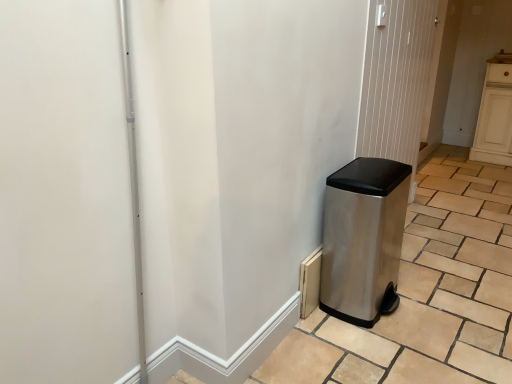
Question: From their relative heights in the image, would you say stainless steel trash can at right is taller or shorter than satin silver trash can at right?

Choices:
 (A) tall
 (B) short

Answer: (A)

Question: Relative to satin silver trash can at right, is stainless steel trash can at right in front or behind?

Choices:
 (A) behind
 (B) front

Answer: (A)

Question: Which object is positioned closest to the stainless steel trash can at right?

Choices:
 (A) satin silver trash can at right
 (B) stainless steel trash can at right

Answer: (A)

Question: Estimate the real-world distances between objects in this image. Which object is closer to the stainless steel trash can at right?

Choices:
 (A) satin silver trash can at right
 (B) stainless steel trash can at right

Answer: (B)